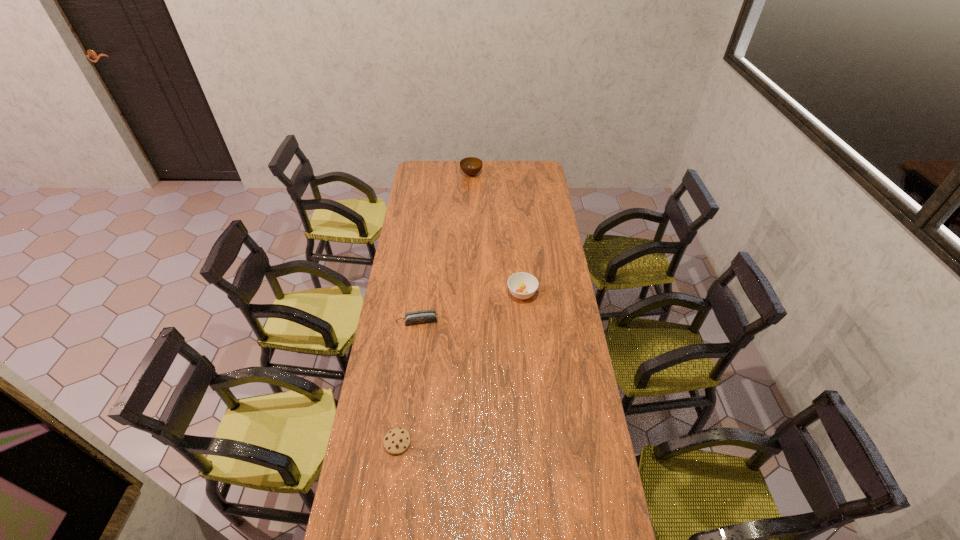
Image resolution: width=960 pixels, height=540 pixels. I want to click on bowl, so (471, 166).

Locate an element on the screen. The width and height of the screenshot is (960, 540). the farthest object is located at coordinates (471, 166).

Where is `soup bowl`? This screenshot has height=540, width=960. soup bowl is located at coordinates (522, 285).

Find the location of a particular element. The image size is (960, 540). the third nearest object is located at coordinates (522, 285).

Find the location of a particular element. This screenshot has width=960, height=540. the second shortest object is located at coordinates (424, 316).

Identify the location of pencil box. The width and height of the screenshot is (960, 540). (424, 316).

You are a GUI agent. You are given a task and a screenshot of the screen. Output one action in this format:
    pyautogui.click(x=<x>, y=<y>)
    Task: Click on the shortest object
    The image size is (960, 540).
    Given the screenshot: What is the action you would take?
    pyautogui.click(x=396, y=441)

Locate an element on the screen. This screenshot has height=540, width=960. cookie is located at coordinates (396, 441).

The image size is (960, 540). Identify the location of vacant space located 0.310m on the right of the second object from right to left. (531, 174).

I want to click on blank space located 0.240m on the back of the second farthest object, so click(x=518, y=250).